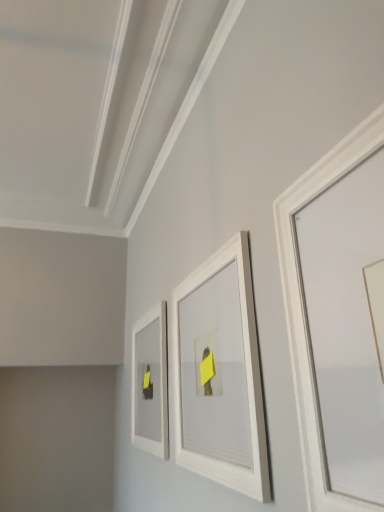
Question: In which direction should I rotate to look at white matte picture frame at center, placed as the 2th picture frame when sorted from right to left?

Choices:
 (A) right
 (B) left

Answer: (A)

Question: Considering the relative sizes of white matte picture frame at upper right, which appears as the first picture frame when viewed from the front, and white matte picture frame at center, the second picture frame positioned from the front, in the image provided, is white matte picture frame at upper right, which appears as the first picture frame when viewed from the front, thinner than white matte picture frame at center, the second picture frame positioned from the front,?

Choices:
 (A) yes
 (B) no

Answer: (A)

Question: Would you say white matte picture frame at center, placed as the 2th picture frame when sorted from right to left, is part of white matte picture frame at upper right, which appears as the first picture frame when viewed from the front,'s contents?

Choices:
 (A) no
 (B) yes

Answer: (A)

Question: Can you confirm if white matte picture frame at upper right, the third picture frame viewed from the back, is taller than white matte picture frame at center, which is the 2th picture frame in back-to-front order?

Choices:
 (A) no
 (B) yes

Answer: (A)

Question: Is white matte picture frame at upper right, which appears as the first picture frame when viewed from the front, aimed at white matte picture frame at center, placed as the 2th picture frame when sorted from right to left?

Choices:
 (A) yes
 (B) no

Answer: (B)

Question: From the image's perspective, is white matte picture frame at upper right, the first picture frame when ordered from right to left, beneath white matte picture frame at center, which is the 2th picture frame in back-to-front order?

Choices:
 (A) yes
 (B) no

Answer: (B)

Question: From a real-world perspective, is white matte picture frame at upper right, the third picture frame viewed from the back, below white matte picture frame at center, which is the 2th picture frame in back-to-front order?

Choices:
 (A) no
 (B) yes

Answer: (A)

Question: From a real-world perspective, is white matte picture frame at center-left, marked as the 3th picture frame in a right-to-left arrangement, beneath white matte picture frame at center, which is the 2th picture frame in back-to-front order?

Choices:
 (A) yes
 (B) no

Answer: (A)

Question: Is the surface of white matte picture frame at center-left, acting as the third picture frame starting from the front, in direct contact with white matte picture frame at center, placed as the 2th picture frame when sorted from right to left?

Choices:
 (A) no
 (B) yes

Answer: (A)

Question: Considering the relative positions of white matte picture frame at center-left, acting as the third picture frame starting from the front, and white matte picture frame at center, arranged as the 2th picture frame when viewed from the left, in the image provided, is white matte picture frame at center-left, acting as the third picture frame starting from the front, to the right of white matte picture frame at center, arranged as the 2th picture frame when viewed from the left, from the viewer's perspective?

Choices:
 (A) no
 (B) yes

Answer: (A)

Question: Does white matte picture frame at center-left, which is counted as the 1th picture frame, starting from the left, have a greater width compared to white matte picture frame at center, the second picture frame positioned from the front?

Choices:
 (A) yes
 (B) no

Answer: (B)

Question: Is white matte picture frame at center-left, marked as the 3th picture frame in a right-to-left arrangement, facing towards white matte picture frame at center, placed as the 2th picture frame when sorted from right to left?

Choices:
 (A) yes
 (B) no

Answer: (B)

Question: Is white matte picture frame at center-left, the 1th picture frame positioned from the back, outside white matte picture frame at center, arranged as the 2th picture frame when viewed from the left?

Choices:
 (A) no
 (B) yes

Answer: (B)

Question: Is white matte picture frame at center, arranged as the 2th picture frame when viewed from the left, smaller than white matte picture frame at center-left, which is counted as the 1th picture frame, starting from the left?

Choices:
 (A) no
 (B) yes

Answer: (A)